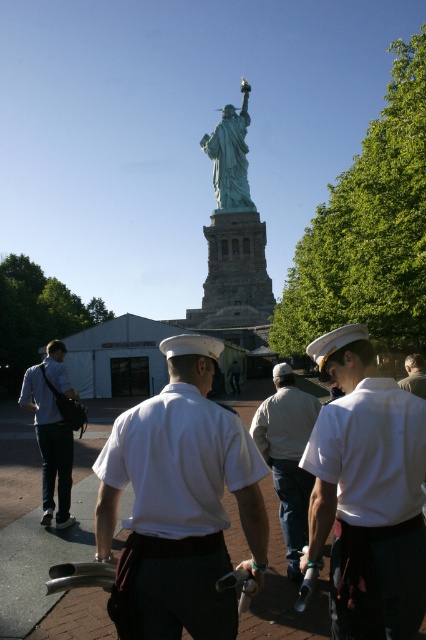
Does point (383, 545) come behind point (45, 444)?

No, it is in front of (45, 444).

Measure the distance from white matte uniform at center to matte white uniform at center.

white matte uniform at center and matte white uniform at center are 37.28 meters apart.

Does point (302, 460) lie behind point (46, 413)?

That is False.

I want to click on white matte uniform at center, so click(376, 499).

Can you confirm if white matte uniform at center is thinner than light gray cotton jacket at center?

Incorrect, white matte uniform at center's width is not less than light gray cotton jacket at center's.

Does white matte uniform at center have a larger size compared to light gray cotton jacket at center?

Yes.

Which is in front, point (377, 433) or point (276, 486)?

Point (377, 433) is more forward.

Where is `white matte uniform at center`? white matte uniform at center is located at coordinates (376, 499).

Can you confirm if white matte uniform at center is smaller than green patina statue at center?

Yes.

Identify the location of white matte uniform at center. (376, 499).

Describe the element at coordinates (376, 499) in the screenshot. I see `white matte uniform at center` at that location.

Locate an element on the screen. white matte uniform at center is located at coordinates (376, 499).